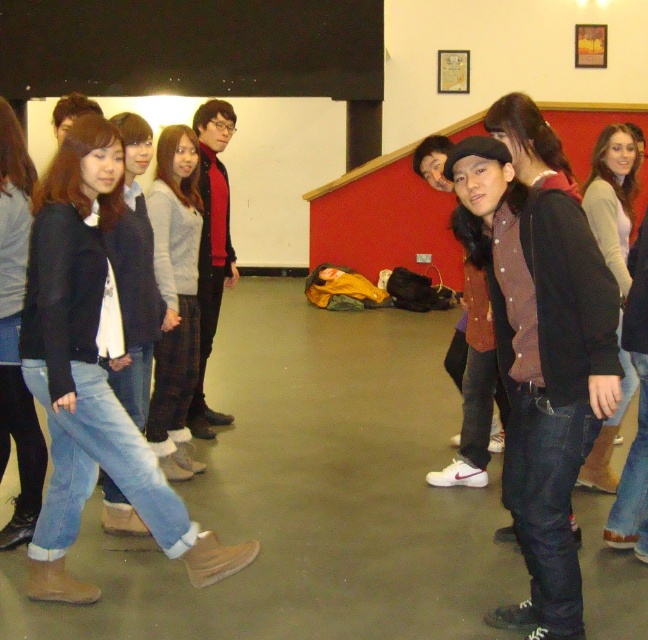
Question: Which is nearer to the flannel plaid pants at center?

Choices:
 (A) light brown leather jacket at center
 (B) denim jeans at left
 (C) dark red sweater at center
 (D) denim jacket at center

Answer: (C)

Question: Which object appears closest to the camera in this image?

Choices:
 (A) denim jacket at center
 (B) light brown leather jacket at center
 (C) dark red sweater at center

Answer: (A)

Question: Does denim jeans at left appear under dark red sweater at center?

Choices:
 (A) no
 (B) yes

Answer: (B)

Question: Is denim jeans at left thinner than light brown leather jacket at center?

Choices:
 (A) no
 (B) yes

Answer: (A)

Question: Which object appears closest to the camera in this image?

Choices:
 (A) light brown leather jacket at center
 (B) denim jacket at center

Answer: (B)

Question: Does denim jacket at center appear on the right side of dark red sweater at center?

Choices:
 (A) yes
 (B) no

Answer: (A)